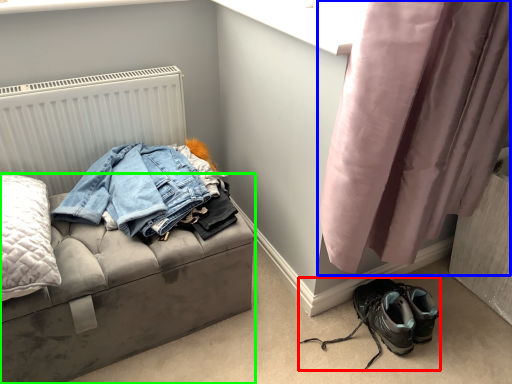
Question: Considering the real-world distances, which object is closest to footwear (highlighted by a red box)? curtain (highlighted by a blue box) or furniture (highlighted by a green box).

Choices:
 (A) curtain
 (B) furniture

Answer: (A)